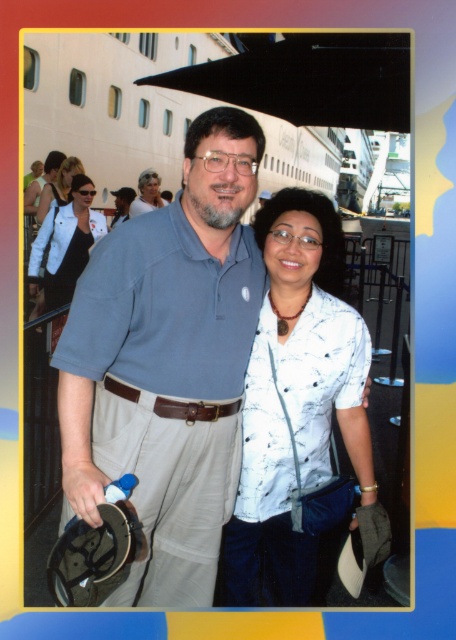
Does matte white blouse at center have a lesser height compared to blonde hair at upper left?

No, matte white blouse at center is not shorter than blonde hair at upper left.

Does matte white blouse at center lie behind blonde hair at upper left?

No, matte white blouse at center is in front of blonde hair at upper left.

Does point (68, 180) come behind point (148, 195)?

No, (68, 180) is closer to viewer.

I want to click on matte white blouse at center, so click(58, 186).

Does matte blue shirt at center have a larger size compared to white smooth cruise ship at upper center?

Incorrect, matte blue shirt at center is not larger than white smooth cruise ship at upper center.

How far apart are matte blue shirt at center and white smooth cruise ship at upper center?

The distance of matte blue shirt at center from white smooth cruise ship at upper center is 5.82 meters.

Find the location of a particular element. matte blue shirt at center is located at coordinates (167, 364).

Where is `matte blue shirt at center`? matte blue shirt at center is located at coordinates (167, 364).

Where is `matte blue shirt at center`? The height and width of the screenshot is (640, 456). matte blue shirt at center is located at coordinates (167, 364).

Is point (175, 276) closer to viewer compared to point (48, 298)?

Yes, it is in front of point (48, 298).

The height and width of the screenshot is (640, 456). I want to click on matte blue shirt at center, so click(x=167, y=364).